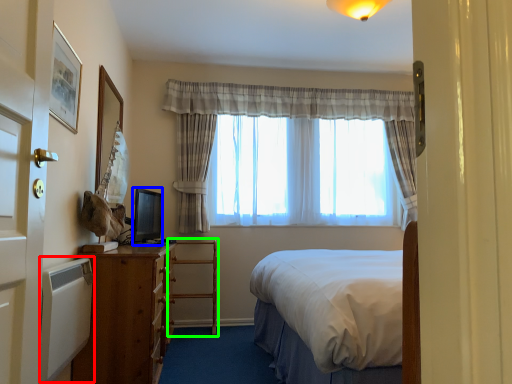
Question: Considering the real-world distances, which object is closest to radiator (highlighted by a red box)? television (highlighted by a blue box) or armchair (highlighted by a green box).

Choices:
 (A) television
 (B) armchair

Answer: (A)